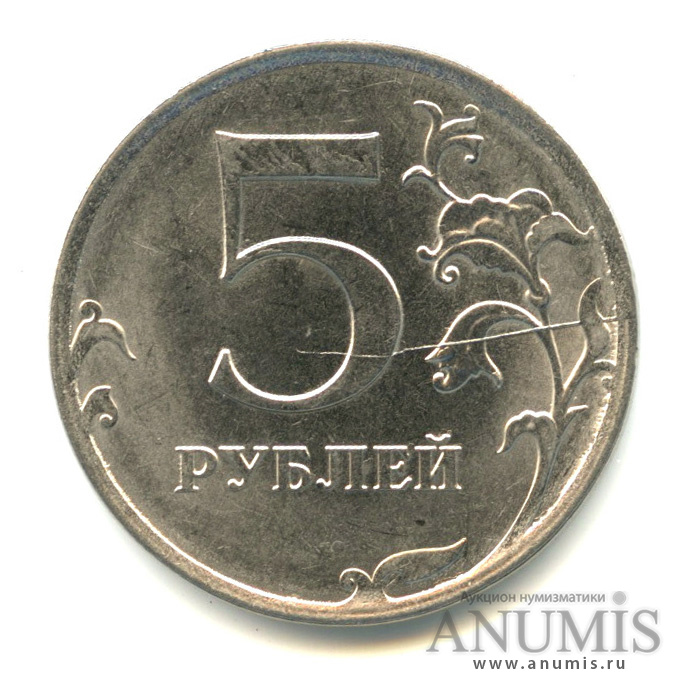
Locate an element on the screen. plant is located at coordinates (477, 221).